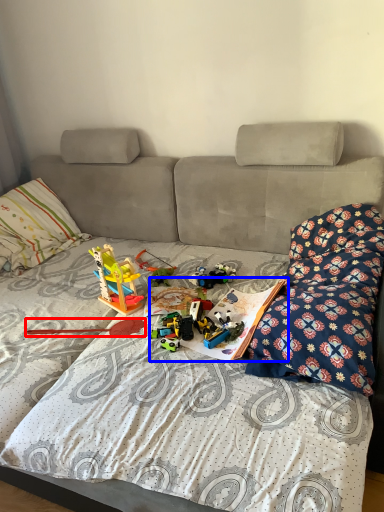
Question: Which of the following is the closest to the observer, twin (highlighted by a red box) or book (highlighted by a blue box)?

Choices:
 (A) twin
 (B) book

Answer: (B)